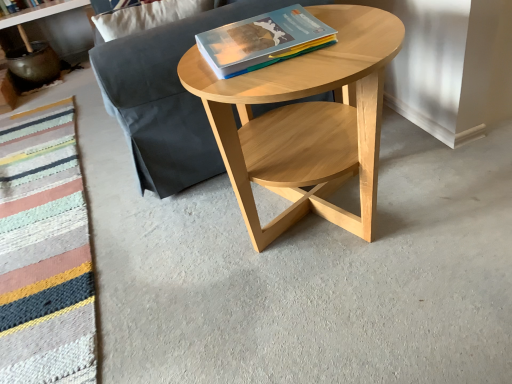
I want to click on vacant area that lies between dark gray fabric couch at center and natural wood coffee table at center, so click(x=198, y=240).